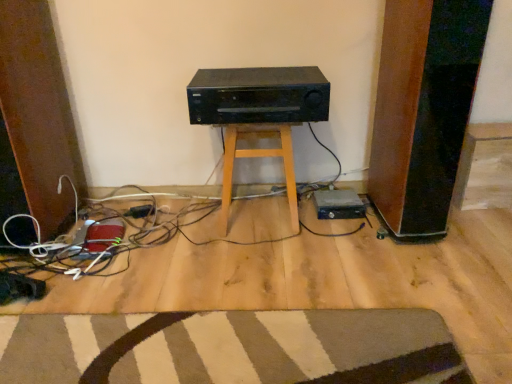
Question: Considering the relative sizes of black matte stereo at center and wooden stool at center in the image provided, is black matte stereo at center bigger than wooden stool at center?

Choices:
 (A) yes
 (B) no

Answer: (B)

Question: Is black matte stereo at center at the right side of wooden stool at center?

Choices:
 (A) no
 (B) yes

Answer: (B)

Question: Is black matte stereo at center closer to camera compared to wooden stool at center?

Choices:
 (A) yes
 (B) no

Answer: (A)

Question: From a real-world perspective, is black matte stereo at center physically above wooden stool at center?

Choices:
 (A) yes
 (B) no

Answer: (A)

Question: Is the depth of black matte stereo at center greater than that of wooden stool at center?

Choices:
 (A) yes
 (B) no

Answer: (B)

Question: From a real-world perspective, is black plastic plug at lower center positioned above or below wooden stool at center?

Choices:
 (A) below
 (B) above

Answer: (A)

Question: Considering the positions of black plastic plug at lower center and wooden stool at center in the image, is black plastic plug at lower center wider or thinner than wooden stool at center?

Choices:
 (A) thin
 (B) wide

Answer: (A)

Question: Considering the positions of black plastic plug at lower center and wooden stool at center in the image, is black plastic plug at lower center bigger or smaller than wooden stool at center?

Choices:
 (A) small
 (B) big

Answer: (A)

Question: Is point (129, 215) positioned closer to the camera than point (287, 193)?

Choices:
 (A) closer
 (B) farther

Answer: (B)

Question: Is point (361, 210) positioned closer to the camera than point (138, 205)?

Choices:
 (A) closer
 (B) farther

Answer: (A)

Question: Is black plastic hard drive at lower right to the left or to the right of black plastic plug at lower center in the image?

Choices:
 (A) right
 (B) left

Answer: (A)

Question: Is black plastic hard drive at lower right bigger or smaller than black plastic plug at lower center?

Choices:
 (A) big
 (B) small

Answer: (A)

Question: From the image's perspective, is black plastic hard drive at lower right positioned above or below black plastic plug at lower center?

Choices:
 (A) above
 (B) below

Answer: (A)

Question: From the image's perspective, is black plastic hard drive at lower right above or below black matte stereo at center?

Choices:
 (A) below
 (B) above

Answer: (A)

Question: Considering their positions, is black plastic hard drive at lower right located in front of or behind black matte stereo at center?

Choices:
 (A) front
 (B) behind

Answer: (B)